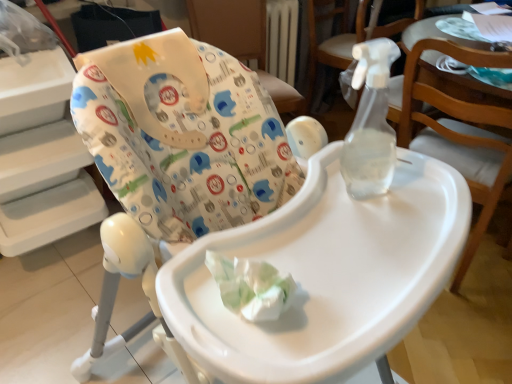
From the picture: How much space does transparent plastic spray bottle at upper right, the third chair positioned from the back, occupy vertically?

transparent plastic spray bottle at upper right, the third chair positioned from the back, is 34.89 inches tall.

The image size is (512, 384). I want to click on white fabric highchair at upper center, which is counted as the 1th chair, starting from the back, so click(242, 40).

The image size is (512, 384). Identify the location of transparent plastic spray bottle at upper right, the second chair positioned from the front. pos(461,135).

From the picture: From a real-world perspective, which is physically below, white fabric highchair at upper center, which is counted as the 1th chair, starting from the back, or transparent plastic spray bottle at upper right, the third chair positioned from the back?

transparent plastic spray bottle at upper right, the third chair positioned from the back, from a real-world perspective.

Can you see white fabric highchair at upper center, the 4th chair in the front-to-back sequence, touching transparent plastic spray bottle at upper right, the third chair positioned from the back?

white fabric highchair at upper center, the 4th chair in the front-to-back sequence, is not next to transparent plastic spray bottle at upper right, the third chair positioned from the back, and they're not touching.

Does white fabric highchair at upper center, the 4th chair in the front-to-back sequence, come in front of transparent plastic spray bottle at upper right, the third chair positioned from the back?

No, white fabric highchair at upper center, the 4th chair in the front-to-back sequence, is behind transparent plastic spray bottle at upper right, the third chair positioned from the back.

How many degrees apart are the facing directions of transparent plastic spray bottle at upper right, the third chair positioned from the back, and white fabric highchair at upper center, the 4th chair in the front-to-back sequence?

The angle between the facing direction of transparent plastic spray bottle at upper right, the third chair positioned from the back, and the facing direction of white fabric highchair at upper center, the 4th chair in the front-to-back sequence, is 90.8 degrees.

Between transparent plastic spray bottle at upper right, the second chair positioned from the front, and white fabric highchair at upper center, the 4th chair in the front-to-back sequence, which one has larger size?

transparent plastic spray bottle at upper right, the second chair positioned from the front.

Considering the relative sizes of transparent plastic spray bottle at upper right, the second chair positioned from the front, and white fabric highchair at upper center, which is counted as the 1th chair, starting from the back, in the image provided, is transparent plastic spray bottle at upper right, the second chair positioned from the front, taller than white fabric highchair at upper center, which is counted as the 1th chair, starting from the back,?

Correct, transparent plastic spray bottle at upper right, the second chair positioned from the front, is much taller as white fabric highchair at upper center, which is counted as the 1th chair, starting from the back.

Is transparent plastic spray bottle at upper right, the third chair from the front, shorter than white plastic highchair at center, the first chair when ordered from front to back?

Yes.

Is point (406, 19) less distant than point (131, 267)?

That is False.

Considering the positions of objects transparent plastic spray bottle at upper right, the third chair from the front, and white plastic highchair at center, the 4th chair positioned from the back, in the image provided, who is more to the right, transparent plastic spray bottle at upper right, the third chair from the front, or white plastic highchair at center, the 4th chair positioned from the back,?

transparent plastic spray bottle at upper right, the third chair from the front.

From a real-world perspective, is transparent plastic spray bottle at upper right, the 2th chair positioned from the back, positioned above or below white plastic highchair at center, the 4th chair positioned from the back?

transparent plastic spray bottle at upper right, the 2th chair positioned from the back, is below white plastic highchair at center, the 4th chair positioned from the back.

From the image's perspective, between transparent plastic spray bottle at upper right, the 2th chair positioned from the back, and white fabric highchair at upper center, the 4th chair in the front-to-back sequence, which one is located above?

transparent plastic spray bottle at upper right, the 2th chair positioned from the back, from the image's perspective.

Between transparent plastic spray bottle at upper right, the 2th chair positioned from the back, and white fabric highchair at upper center, the 4th chair in the front-to-back sequence, which one has larger width?

transparent plastic spray bottle at upper right, the 2th chair positioned from the back.

Measure the distance between transparent plastic spray bottle at upper right, the 2th chair positioned from the back, and white fabric highchair at upper center, the 4th chair in the front-to-back sequence.

transparent plastic spray bottle at upper right, the 2th chair positioned from the back, is 26.96 inches away from white fabric highchair at upper center, the 4th chair in the front-to-back sequence.

Are transparent plastic spray bottle at upper right, the 2th chair positioned from the back, and white fabric highchair at upper center, which is counted as the 1th chair, starting from the back, located far from each other?

No, transparent plastic spray bottle at upper right, the 2th chair positioned from the back, is in close proximity to white fabric highchair at upper center, which is counted as the 1th chair, starting from the back.

From the image's perspective, which object appears higher, transparent plastic spray bottle at upper right, the third chair positioned from the back, or transparent plastic spray bottle at upper right, the third chair from the front?

transparent plastic spray bottle at upper right, the third chair from the front, is shown above in the image.

Visually, is transparent plastic spray bottle at upper right, the third chair positioned from the back, positioned to the left or to the right of transparent plastic spray bottle at upper right, the third chair from the front?

In the image, transparent plastic spray bottle at upper right, the third chair positioned from the back, appears on the right side of transparent plastic spray bottle at upper right, the third chair from the front.

Measure the distance between transparent plastic spray bottle at upper right, the third chair positioned from the back, and transparent plastic spray bottle at upper right, the 2th chair positioned from the back.

transparent plastic spray bottle at upper right, the third chair positioned from the back, and transparent plastic spray bottle at upper right, the 2th chair positioned from the back, are 35.23 inches apart.

In terms of height, does transparent plastic spray bottle at upper right, the second chair positioned from the front, look taller or shorter compared to transparent plastic spray bottle at upper right, the 2th chair positioned from the back?

Clearly, transparent plastic spray bottle at upper right, the second chair positioned from the front, is taller compared to transparent plastic spray bottle at upper right, the 2th chair positioned from the back.

Which is nearer, (289, 113) or (315, 48)?

The point (289, 113) is closer to the camera.

Is white fabric highchair at upper center, which is counted as the 1th chair, starting from the back, bigger than transparent plastic spray bottle at upper right, the third chair from the front?

No.

Considering the sizes of objects white fabric highchair at upper center, the 4th chair in the front-to-back sequence, and transparent plastic spray bottle at upper right, the 2th chair positioned from the back, in the image provided, who is thinner, white fabric highchair at upper center, the 4th chair in the front-to-back sequence, or transparent plastic spray bottle at upper right, the 2th chair positioned from the back,?

Thinner between the two is white fabric highchair at upper center, the 4th chair in the front-to-back sequence.

From a real-world perspective, count 2nd chairs downward from the white fabric highchair at upper center, the 4th chair in the front-to-back sequence, and point to it. Please provide its 2D coordinates.

[(332, 43)]

Is white plastic highchair at center, the first chair when ordered from front to back, positioned beyond the bounds of transparent plastic spray bottle at upper right, the second chair positioned from the front?

Yes.

In terms of height, does white plastic highchair at center, the 4th chair positioned from the back, look taller or shorter compared to transparent plastic spray bottle at upper right, the second chair positioned from the front?

Clearly, white plastic highchair at center, the 4th chair positioned from the back, is taller compared to transparent plastic spray bottle at upper right, the second chair positioned from the front.

Can you confirm if white plastic highchair at center, the 4th chair positioned from the back, is positioned to the right of transparent plastic spray bottle at upper right, the third chair positioned from the back?

No.

In the scene shown: Between white plastic highchair at center, the first chair when ordered from front to back, and transparent plastic spray bottle at upper right, the third chair positioned from the back, which one has larger width?

white plastic highchair at center, the first chair when ordered from front to back, is wider.

You are a GUI agent. You are given a task and a screenshot of the screen. Output one action in this format:
    pyautogui.click(x=<x>, y=<y>)
    Task: Click on the chair that is the 1st one above the transparent plastic spray bottle at upper right, the third chair positioned from the back (from a real-world perspective)
    
    Given the screenshot: What is the action you would take?
    pyautogui.click(x=242, y=40)

This screenshot has width=512, height=384. What are the coordinates of `chair that is the 2nd one when counting forward from the white fabric highchair at upper center, which is counted as the 1th chair, starting from the back` in the screenshot? It's located at (461, 135).

When comparing their distances from transparent plastic spray bottle at upper right, the second chair positioned from the front, does transparent plastic spray bottle at upper right, the third chair from the front, or white fabric highchair at upper center, which is counted as the 1th chair, starting from the back, seem closer?

transparent plastic spray bottle at upper right, the third chair from the front.

Looking at the image, which one is located closer to transparent plastic spray bottle at upper right, the 2th chair positioned from the back, white fabric highchair at upper center, the 4th chair in the front-to-back sequence, or white plastic highchair at center, the 4th chair positioned from the back?

The object closer to transparent plastic spray bottle at upper right, the 2th chair positioned from the back, is white fabric highchair at upper center, the 4th chair in the front-to-back sequence.

Estimate the real-world distances between objects in this image. Which object is further from white fabric highchair at upper center, the 4th chair in the front-to-back sequence, transparent plastic spray bottle at upper right, the third chair from the front, or transparent plastic spray bottle at upper right, the second chair positioned from the front?

Based on the image, transparent plastic spray bottle at upper right, the second chair positioned from the front, appears to be further to white fabric highchair at upper center, the 4th chair in the front-to-back sequence.

Which object lies nearer to the anchor point white plastic highchair at center, the first chair when ordered from front to back, transparent plastic spray bottle at upper right, the second chair positioned from the front, or white fabric highchair at upper center, which is counted as the 1th chair, starting from the back?

transparent plastic spray bottle at upper right, the second chair positioned from the front.

From the image, which object appears to be nearer to transparent plastic spray bottle at upper right, the third chair from the front, white plastic highchair at center, the first chair when ordered from front to back, or transparent plastic spray bottle at upper right, the third chair positioned from the back?

transparent plastic spray bottle at upper right, the third chair positioned from the back, is closer to transparent plastic spray bottle at upper right, the third chair from the front.

When comparing their distances from transparent plastic spray bottle at upper right, the second chair positioned from the front, does white plastic highchair at center, the 4th chair positioned from the back, or transparent plastic spray bottle at upper right, the 2th chair positioned from the back, seem closer?

Among the two, white plastic highchair at center, the 4th chair positioned from the back, is located nearer to transparent plastic spray bottle at upper right, the second chair positioned from the front.

Estimate the real-world distances between objects in this image. Which object is further from transparent plastic spray bottle at upper right, the second chair positioned from the front, white fabric highchair at upper center, which is counted as the 1th chair, starting from the back, or white plastic highchair at center, the 4th chair positioned from the back?

white fabric highchair at upper center, which is counted as the 1th chair, starting from the back, lies further to transparent plastic spray bottle at upper right, the second chair positioned from the front, than the other object.

Based on the photo, looking at the image, which one is located further to transparent plastic spray bottle at upper right, the third chair from the front, transparent plastic spray bottle at upper right, the third chair positioned from the back, or white plastic highchair at center, the 4th chair positioned from the back?

Based on the image, white plastic highchair at center, the 4th chair positioned from the back, appears to be further to transparent plastic spray bottle at upper right, the third chair from the front.

The height and width of the screenshot is (384, 512). Identify the location of chair between transparent plastic spray bottle at upper right, the third chair positioned from the back, and white fabric highchair at upper center, which is counted as the 1th chair, starting from the back, in the front-back direction. (332, 43).

Identify the location of chair between white plastic highchair at center, the first chair when ordered from front to back, and transparent plastic spray bottle at upper right, the third chair from the front, along the z-axis. The height and width of the screenshot is (384, 512). (461, 135).